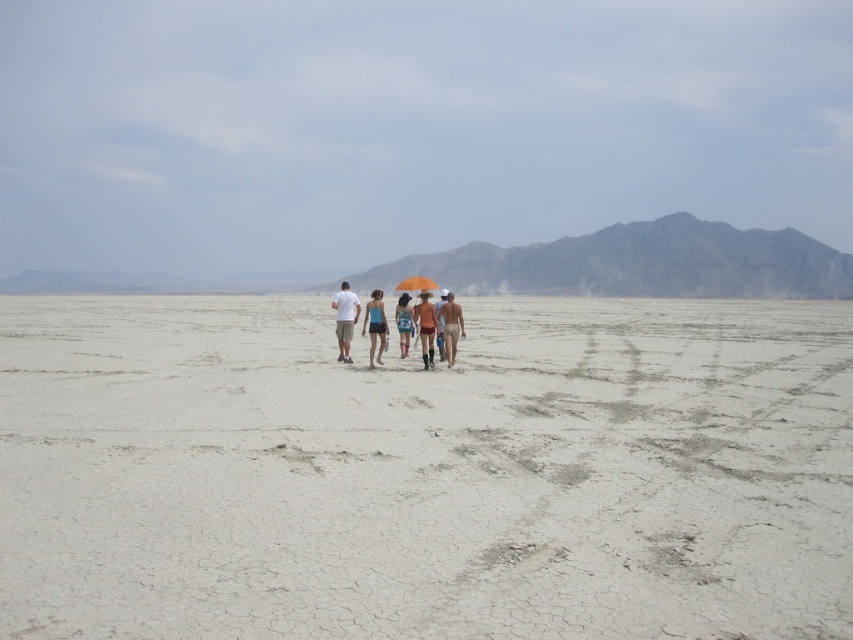
You are a photographer trying to capture the group in the desert. You notice the floral fabric dress at center and the orange matte umbrella at center. Which object should you focus on if you want to capture something taller in the scene?

The floral fabric dress at center is much taller than the orange matte umbrella at center, so you should focus on the floral fabric dress at center to capture something taller in the scene.

You are standing in the desert and see two points marked on the ground. The first point is at coordinate point (445, 356) and the second point is at coordinate point (418, 316). Which point is closer to you?

Point (445, 356) is closer to you because it is further to the viewer than point (418, 316).

You are part of the group walking in the desert and need to decide who to ask for directions. Since you want to approach someone closer to the middle of the group, which person should you choose between the white cotton shirt at center and the floral fabric dress at center?

The white cotton shirt at center is smaller than the floral fabric dress at center, so the floral fabric dress at center is likely positioned closer to the middle of the group, making it a better choice to approach for directions.